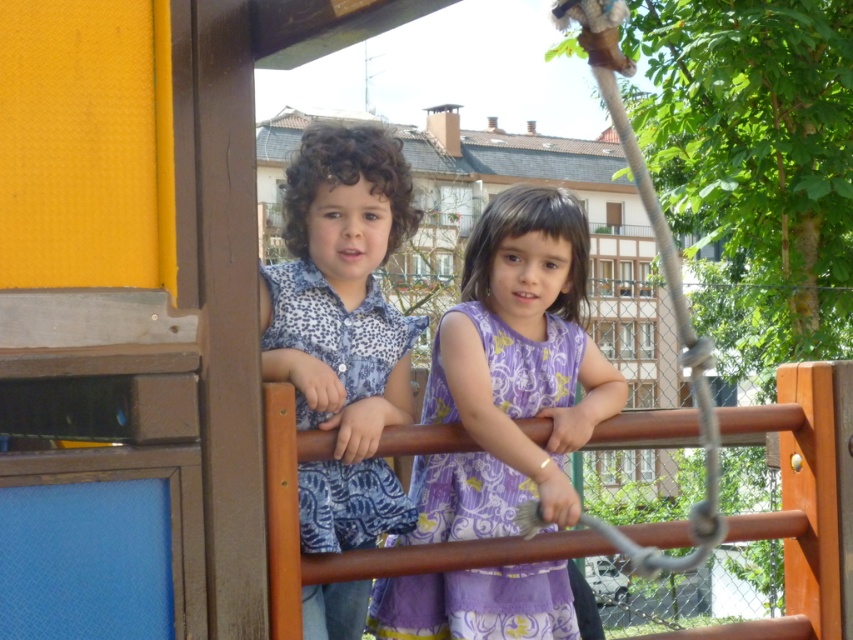
You are a photographer trying to capture a photo of both the blue patterned shirt at center and the purple floral fabric dress at center. Based on their positions, which child should you focus on first if you want to include both in the frame without moving your camera?

You should focus on the purple floral fabric dress at center first because the blue patterned shirt at center is to the left of it, meaning the purple floral fabric dress at center is closer to the right side of the frame. By centering the purple floral fabric dress at center, you can ensure the blue patterned shirt at center at the left remains in the frame without needing to adjust the camera position.

You are a photographer positioned at the front of the playground structure. You want to take a photo of both the blue patterned shirt at center and the purple floral fabric dress at center. Which child should you focus on first to ensure both are in clear focus?

The blue patterned shirt at center is closer to the viewer than the purple floral fabric dress at center. To ensure both are in clear focus, focus on the blue patterned shirt at center first since it is closer, and the depth of field will naturally include the farther purple floral fabric dress at center.

You are a photographer taking a picture of the blue patterned shirt at center and the purple floral fabric dress at center. Which child should you adjust to be closer to the camera to ensure both are in focus?

The blue patterned shirt at center is taller than the purple floral fabric dress at center, so you should adjust the child in the purple floral fabric dress at center to be closer to the camera to ensure both are in focus.